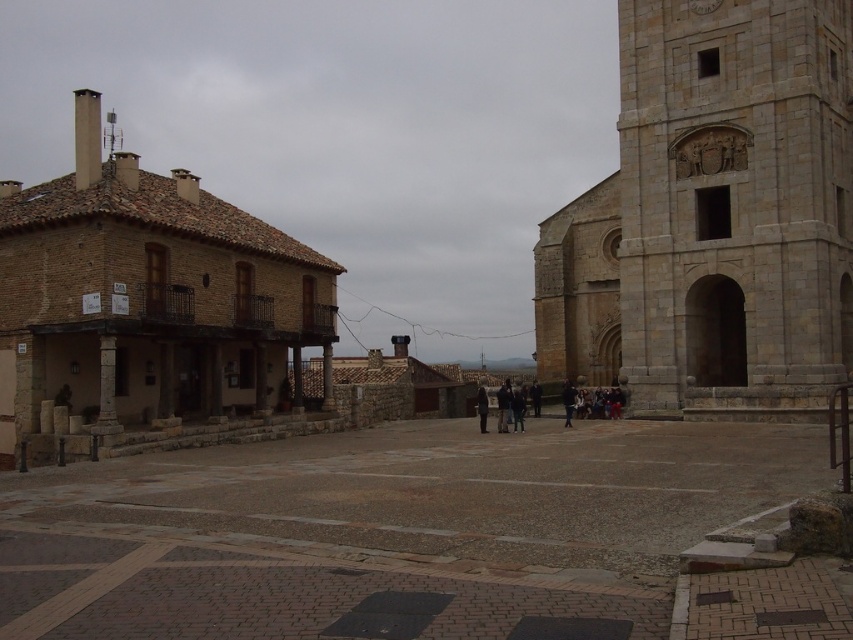
This screenshot has width=853, height=640. What do you see at coordinates (149, 312) in the screenshot?
I see `brown brick church at left` at bounding box center [149, 312].

Is brown brick church at left above dark blue jacket at center?

Yes, brown brick church at left is above dark blue jacket at center.

The width and height of the screenshot is (853, 640). Describe the element at coordinates (149, 312) in the screenshot. I see `brown brick church at left` at that location.

Image resolution: width=853 pixels, height=640 pixels. Find the location of `brown brick church at left`. brown brick church at left is located at coordinates click(149, 312).

Measure the distance from smooth stone pavement at center to brown brick church at left.

The distance of smooth stone pavement at center from brown brick church at left is 17.67 meters.

Who is lower down, smooth stone pavement at center or brown brick church at left?

smooth stone pavement at center is below.

Is point (360, 518) closer to viewer compared to point (97, 262)?

Yes.

I want to click on smooth stone pavement at center, so (387, 531).

Which is more to the left, smooth stone pavement at center or gold textured clock at upper right?

smooth stone pavement at center is more to the left.

Which is behind, point (119, 531) or point (721, 1)?

The point (721, 1) is behind.

What do you see at coordinates (387, 531) in the screenshot? I see `smooth stone pavement at center` at bounding box center [387, 531].

The width and height of the screenshot is (853, 640). Find the location of `smooth stone pavement at center`. smooth stone pavement at center is located at coordinates (387, 531).